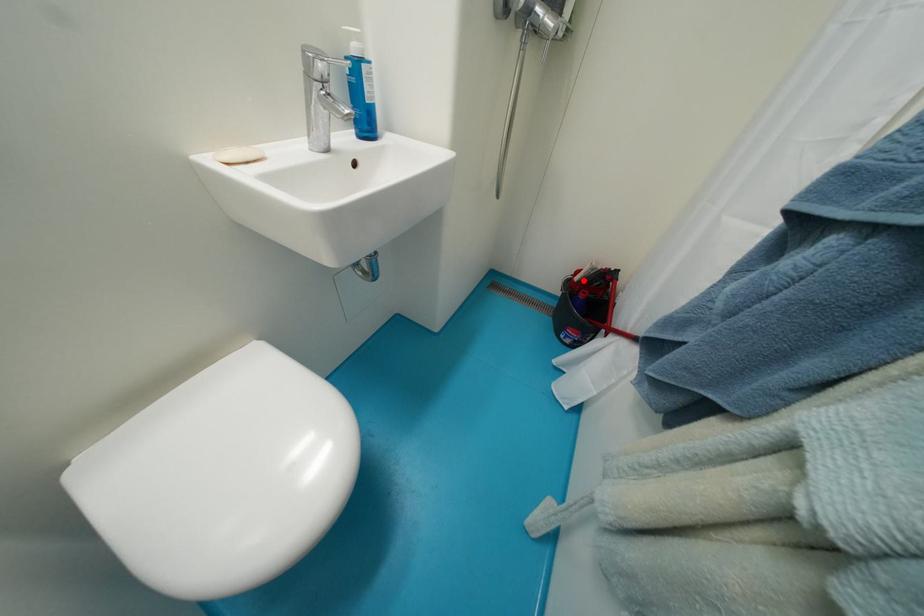
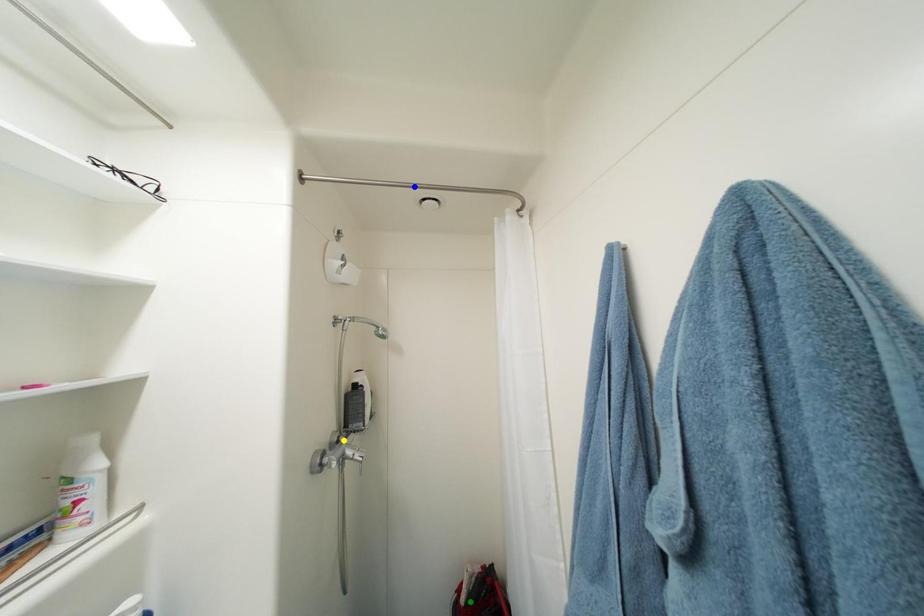
Question: I am providing you with two images of the same scene from different viewpoints. A red point is marked on the first image. You are given multiple points on the second image. In image 2, which mark is for the same physical point as the one in image 1?

Choices:
 (A) blue point
 (B) green point
 (C) yellow point

Answer: (B)